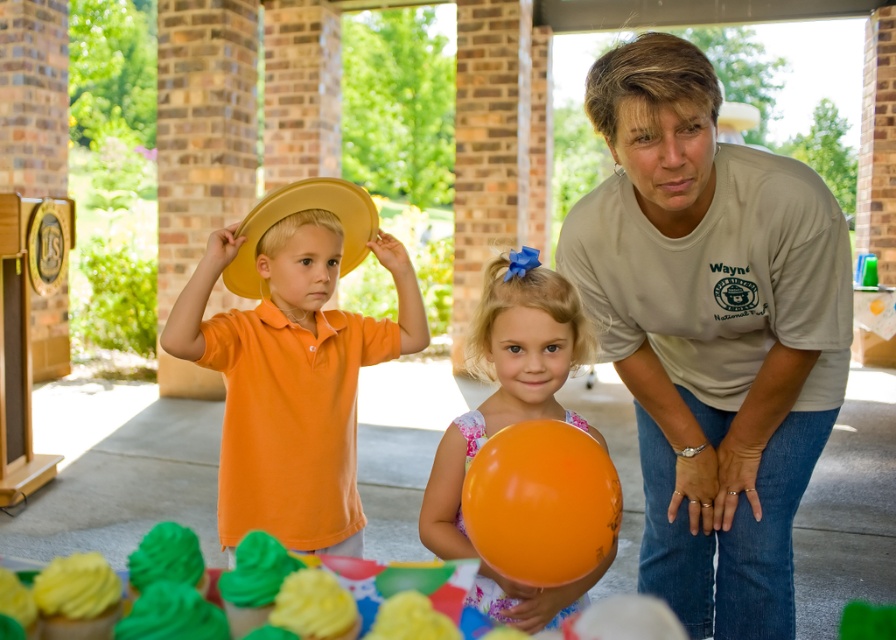
You are a photographer standing in front of the pavilion. You want to take a photo of the orange glossy balloon at center and the yellow straw hat at center. Which object will appear larger in the photo?

The orange glossy balloon at center will appear larger in the photo because it is closer to the viewer than the yellow straw hat at center.

You are planning to hang a banner between the orange glossy balloon at center and the yellow straw hat at center. The banner is 36 inches long. Will the banner fit perfectly between them without needing adjustments?

The orange glossy balloon at center and yellow straw hat at center are 36.44 inches apart. The banner is 36 inches long, which is slightly shorter than the distance between them. Therefore, the banner will fit but will require some adjustment to center it properly between the two objects.